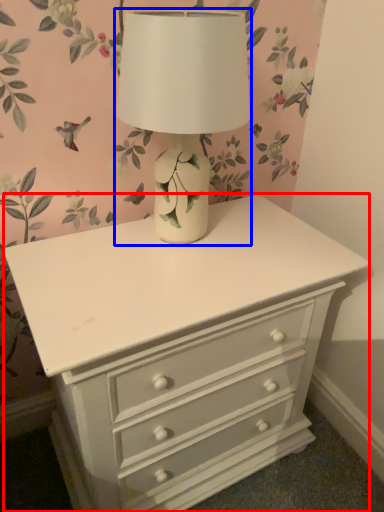
Question: Among these objects, which one is farthest to the camera, chest of drawers (highlighted by a red box) or table lamp (highlighted by a blue box)?

Choices:
 (A) chest of drawers
 (B) table lamp

Answer: (A)